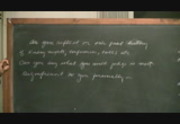
Where is `cut off words on chalkboard`? cut off words on chalkboard is located at coordinates (177, 59), (179, 51), (179, 83).